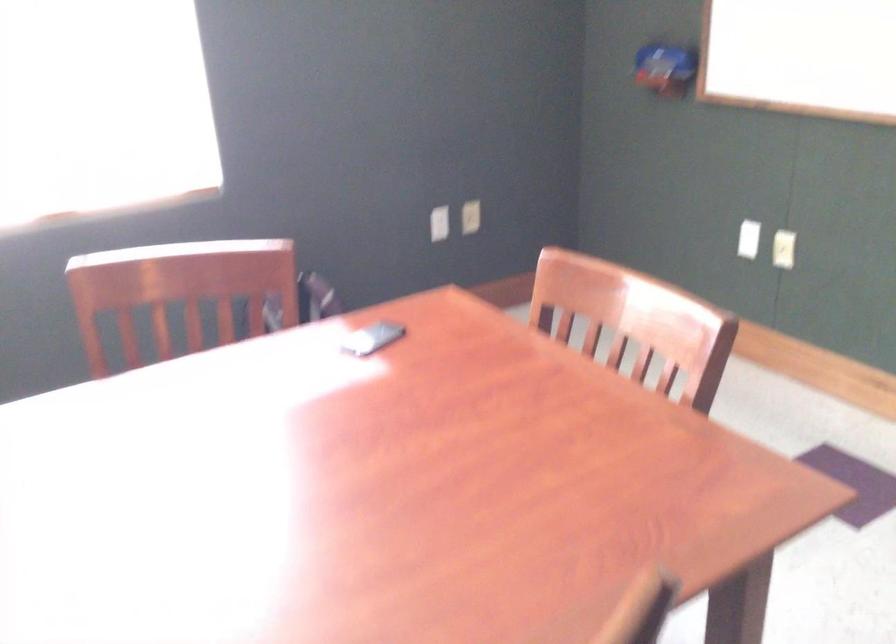
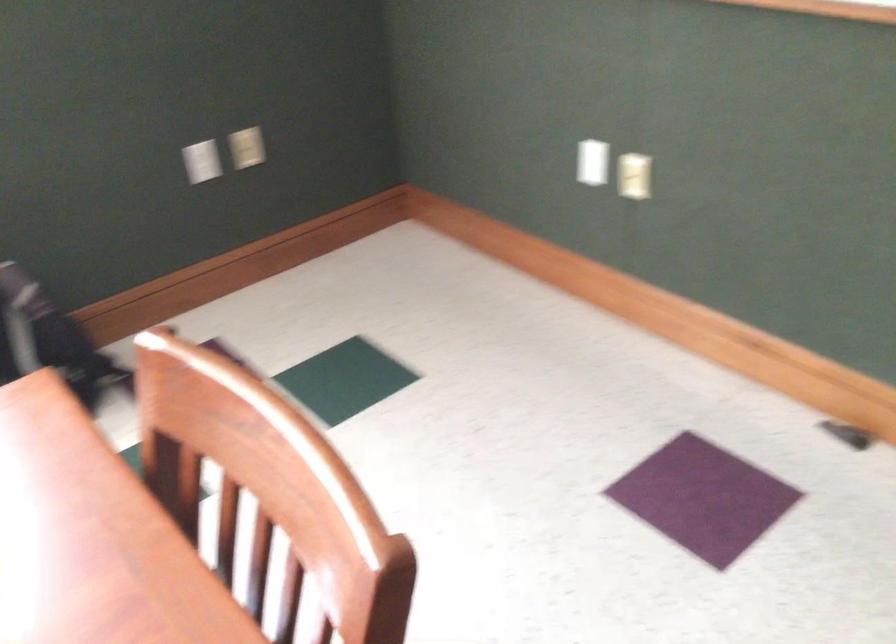
What movement of the cameraman would produce the second image?

The cameraman moved toward right, forward.